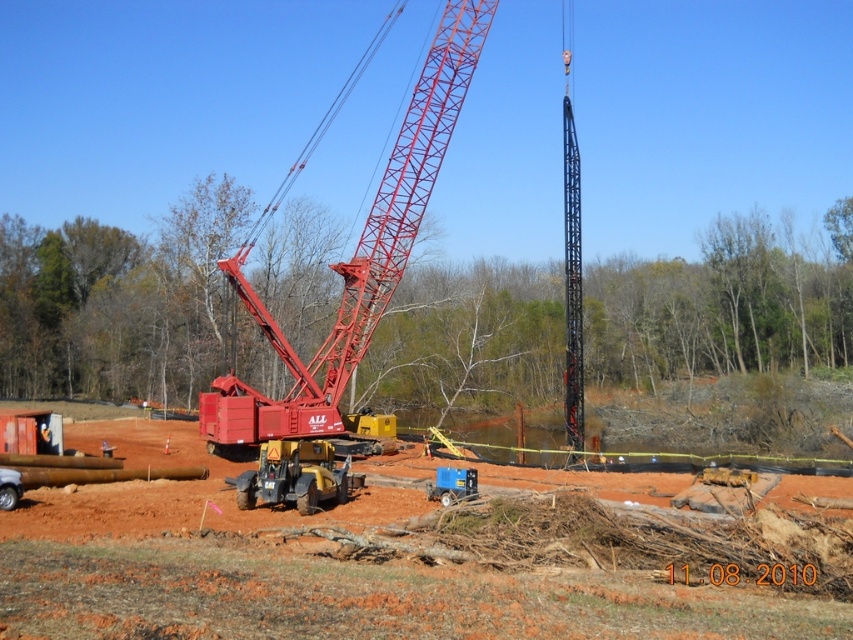
Does matte yellow excavator at center have a lesser width compared to yellow rubber tractor at center?

No.

What do you see at coordinates (360, 595) in the screenshot? I see `matte yellow excavator at center` at bounding box center [360, 595].

This screenshot has height=640, width=853. I want to click on matte yellow excavator at center, so click(x=360, y=595).

Which of these two, metallic red crane at center or yellow rubber tractor at center, stands taller?

metallic red crane at center

Is point (392, 209) in front of point (282, 451)?

No, (392, 209) is behind (282, 451).

In order to click on metallic red crane at center in this screenshot , I will do `click(354, 259)`.

Image resolution: width=853 pixels, height=640 pixels. What are the coordinates of `metallic red crane at center` in the screenshot? It's located at (354, 259).

Where is `matte yellow excavator at center`? The height and width of the screenshot is (640, 853). matte yellow excavator at center is located at coordinates (360, 595).

This screenshot has width=853, height=640. In order to click on matte yellow excavator at center in this screenshot , I will do `click(360, 595)`.

What are the coordinates of `matte yellow excavator at center` in the screenshot? It's located at (360, 595).